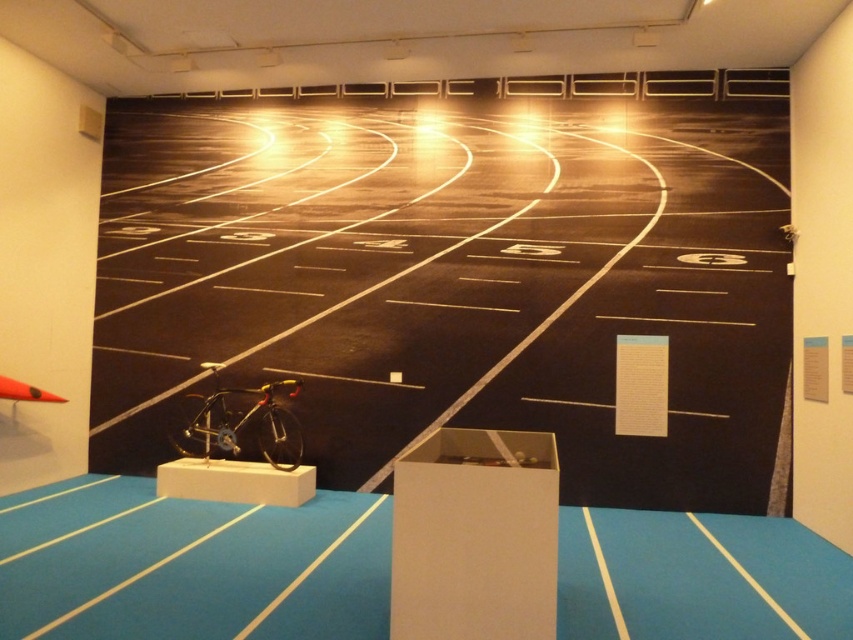
You are standing at the point labeled as point (453, 280) in the indoor track scene. Based on the description, what surface are you currently standing on?

The point (453, 280) is on the smooth asphalt race track at center, so you are standing on the smooth asphalt race track at center.